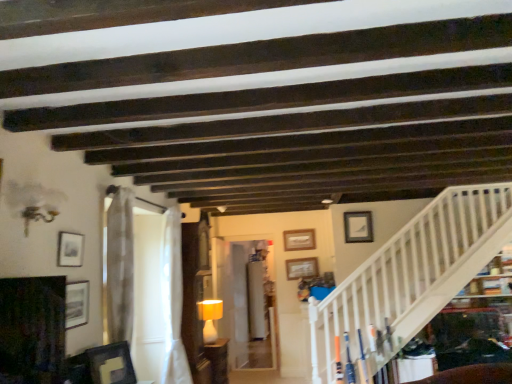
Question: Would you say matte black picture frame at left, which is the 1th picture frame in front-to-back order, is to the left or to the right of matte black picture frame at lower left, the fourth picture frame viewed from the back, in the picture?

Choices:
 (A) right
 (B) left

Answer: (B)

Question: Looking at their shapes, would you say matte black picture frame at left, the 6th picture frame when ordered from back to front, is wider or thinner than matte black picture frame at lower left, which ranks as the 4th picture frame in right-to-left order?

Choices:
 (A) wide
 (B) thin

Answer: (B)

Question: Considering the real-world distances, which object is farthest from the wooden picture frame at center, which ranks as the 5th picture frame in front-to-back order?

Choices:
 (A) matte yellow lampshade at center
 (B) matte yellow lampshade at center
 (C) matte black picture frame at lower left, which ranks as the 4th picture frame in right-to-left order
 (D) wooden picture frame at upper center, the sixth picture frame positioned from the front
 (E) matte white picture frame at upper right, marked as the sixth picture frame in a left-to-right arrangement

Answer: (C)

Question: Estimate the real-world distances between objects in this image. Which object is farther from the matte yellow lampshade at center?

Choices:
 (A) wooden picture frame at upper center, which ranks as the 1th picture frame in back-to-front order
 (B) matte yellow lampshade at center
 (C) wooden picture frame at center, which is counted as the second picture frame, starting from the right
 (D) matte black picture frame at upper left, which ranks as the 6th picture frame in right-to-left order
 (E) white sheer curtain at center, the first curtain in the back-to-front sequence

Answer: (D)